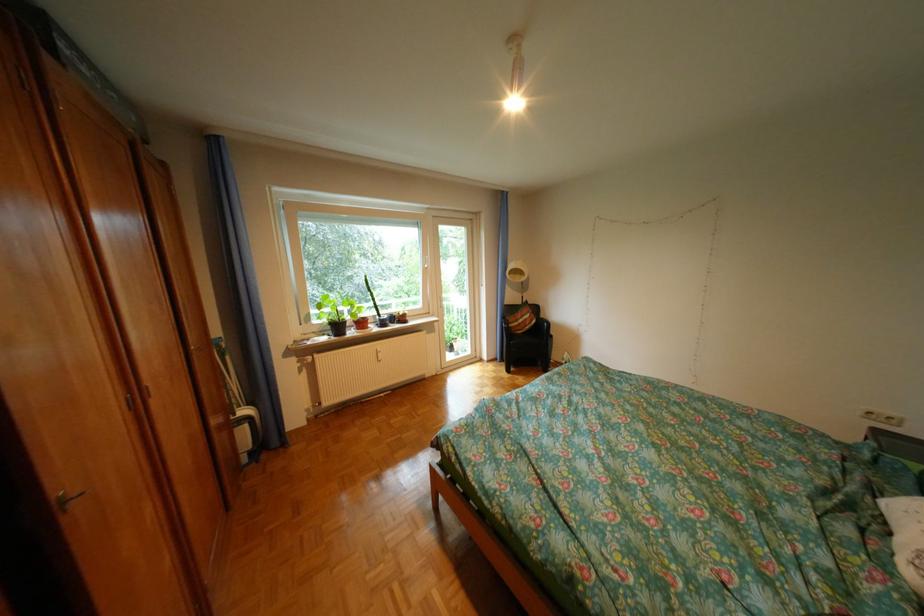
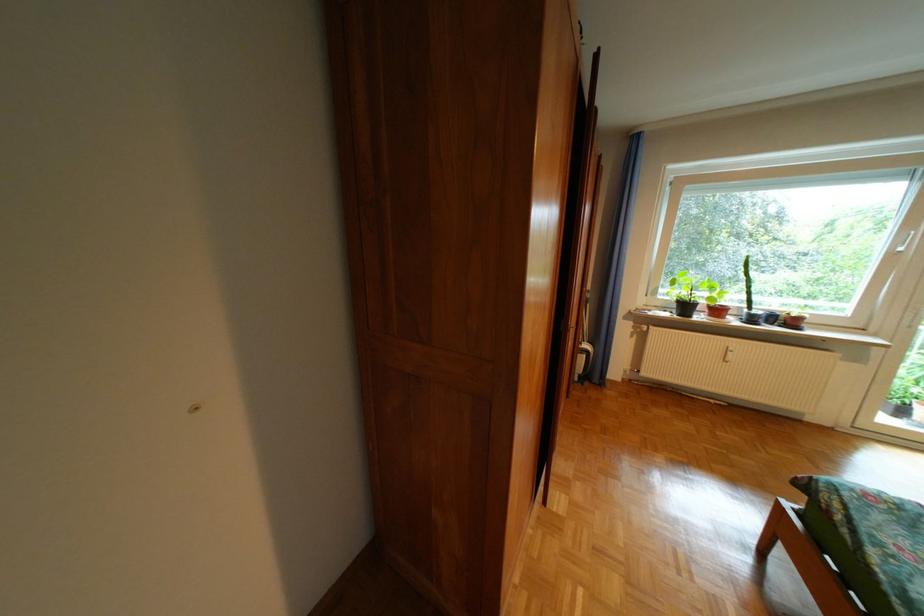
Locate, in the second image, the point that corresponds to (x=382, y=312) in the first image.

(747, 300)